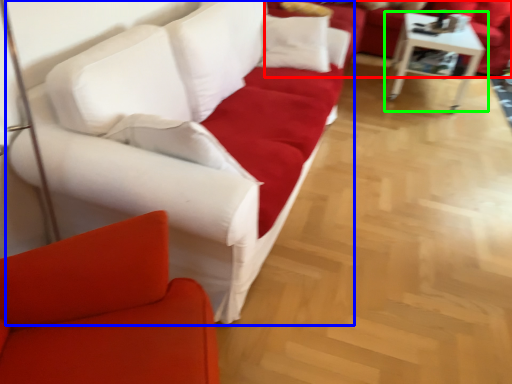
Question: Based on their relative distances, which object is farther from studio couch (highlighted by a red box)? Choose from studio couch (highlighted by a blue box) and table (highlighted by a green box).

Choices:
 (A) studio couch
 (B) table

Answer: (A)